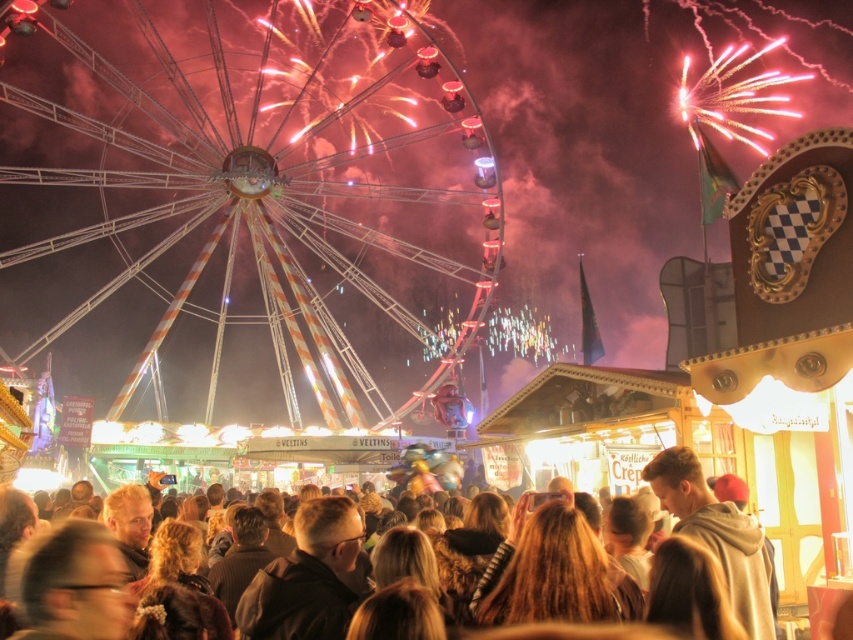
Question: Which point is closer to the camera taking this photo?

Choices:
 (A) (283, 116)
 (B) (740, 595)
 (C) (744, 621)

Answer: (C)

Question: Is brown hair at center to the right of light brown hoodie at center from the viewer's perspective?

Choices:
 (A) yes
 (B) no

Answer: (B)

Question: Which of the following is the closest to the observer?

Choices:
 (A) light brown hoodie at center
 (B) metallic ferris wheel at center
 (C) brown hair at center

Answer: (C)

Question: Based on their relative distances, which object is nearer to the brown hair at center?

Choices:
 (A) metallic ferris wheel at center
 (B) light brown hoodie at center

Answer: (B)

Question: Does brown hair at center have a lesser width compared to light brown hoodie at center?

Choices:
 (A) no
 (B) yes

Answer: (A)

Question: Is brown hair at center wider than light brown hoodie at center?

Choices:
 (A) no
 (B) yes

Answer: (B)